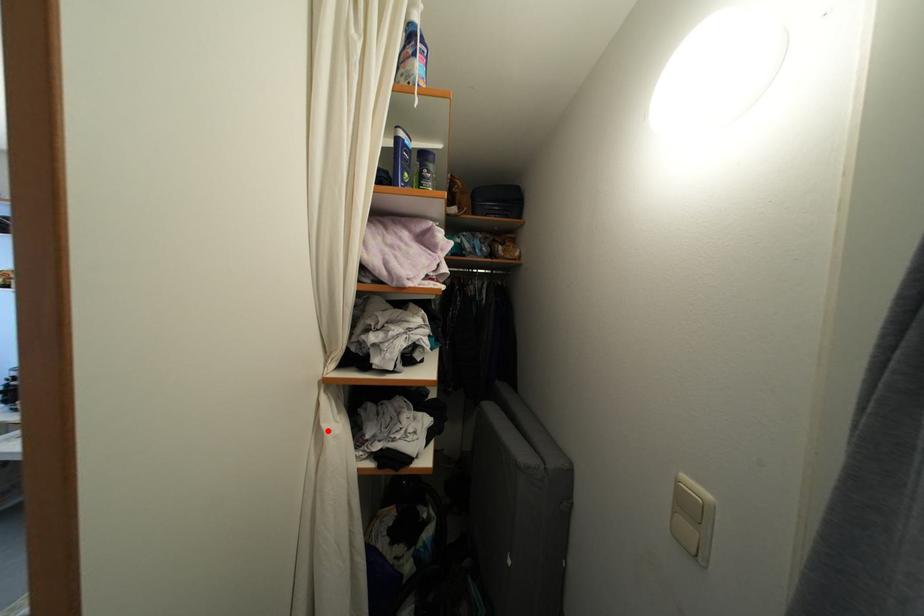
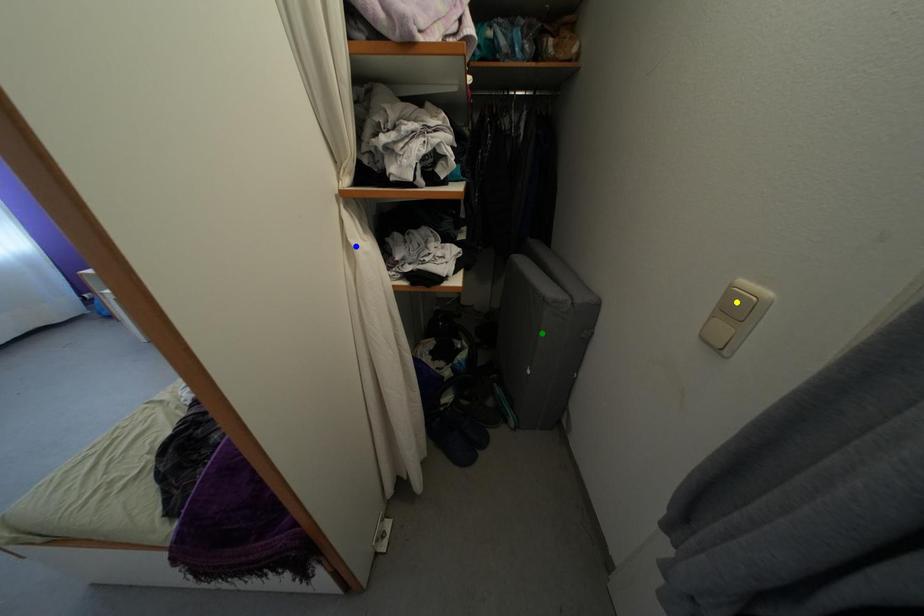
Question: I am providing you with two images of the same scene from different viewpoints. A red point is marked on the first image. You are given multiple points on the second image. Which point in image 2 represents the same 3d spot as the red point in image 1?

Choices:
 (A) yellow point
 (B) blue point
 (C) green point

Answer: (B)